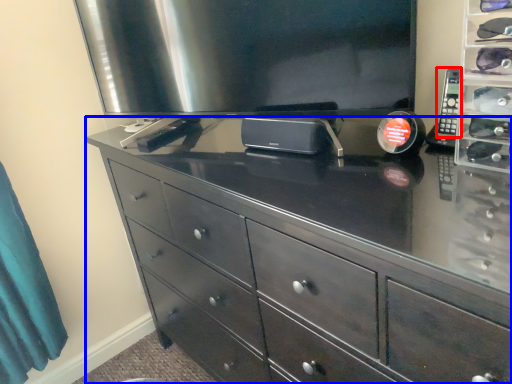
Question: Among these objects, which one is nearest to the camera, control (highlighted by a red box) or chest of drawers (highlighted by a blue box)?

Choices:
 (A) control
 (B) chest of drawers

Answer: (B)